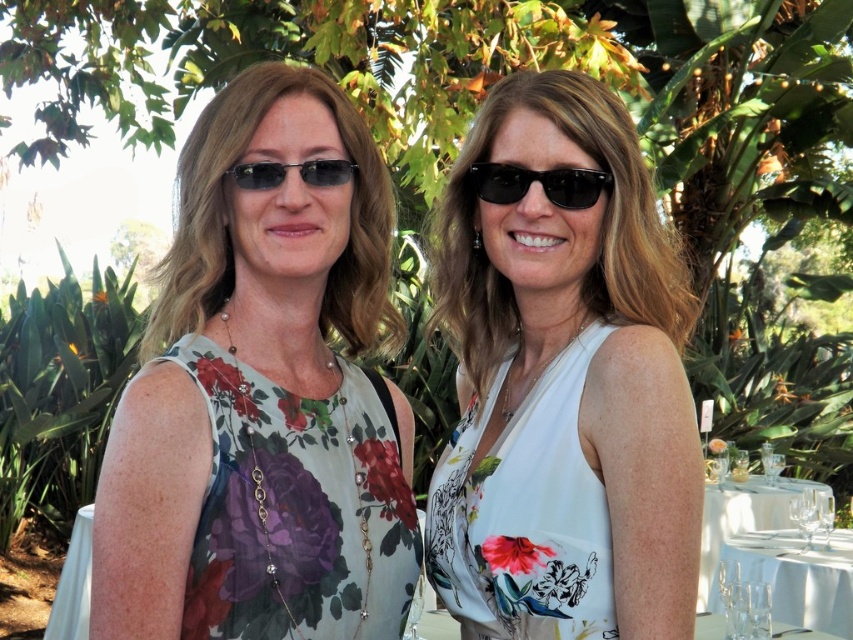
Question: Is white floral dress at center wider than black plastic sunglasses at center?

Choices:
 (A) yes
 (B) no

Answer: (A)

Question: Which object is farther from the camera taking this photo?

Choices:
 (A) white floral fabric dress at center
 (B) matte black sunglasses at left
 (C) white glassware at lower right
 (D) white floral dress at center

Answer: (C)

Question: Is floral print fabric dress at left smaller than matte black sunglasses at left?

Choices:
 (A) no
 (B) yes

Answer: (A)

Question: Does white floral dress at center have a greater width compared to clear glassware at lower right?

Choices:
 (A) no
 (B) yes

Answer: (A)

Question: Which point is farther from the camera taking this photo?

Choices:
 (A) (848, 605)
 (B) (552, 188)
 (C) (618, 577)

Answer: (A)

Question: Among these objects, which one is nearest to the camera?

Choices:
 (A) floral print fabric dress at left
 (B) floral fabric dress at center

Answer: (B)